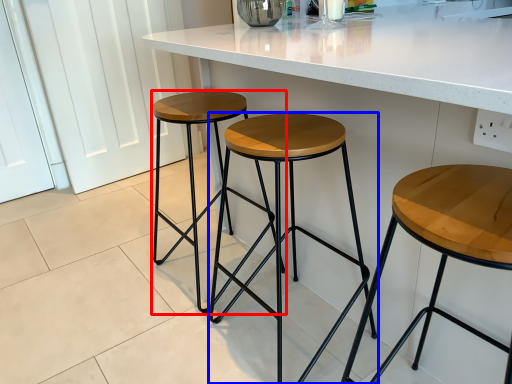
Question: Which object appears farthest to the camera in this image, stool (highlighted by a red box) or stool (highlighted by a blue box)?

Choices:
 (A) stool
 (B) stool

Answer: (A)